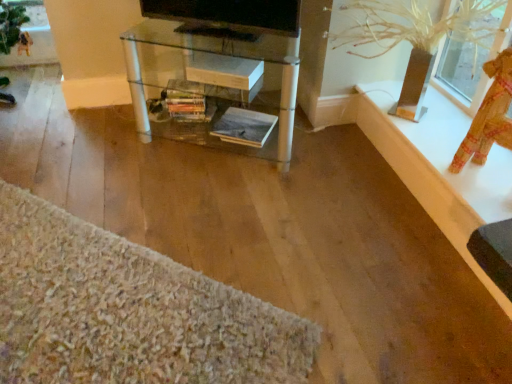
Find the location of a particular element. vacant area on the back side of textured beige rug at lower left is located at coordinates (136, 178).